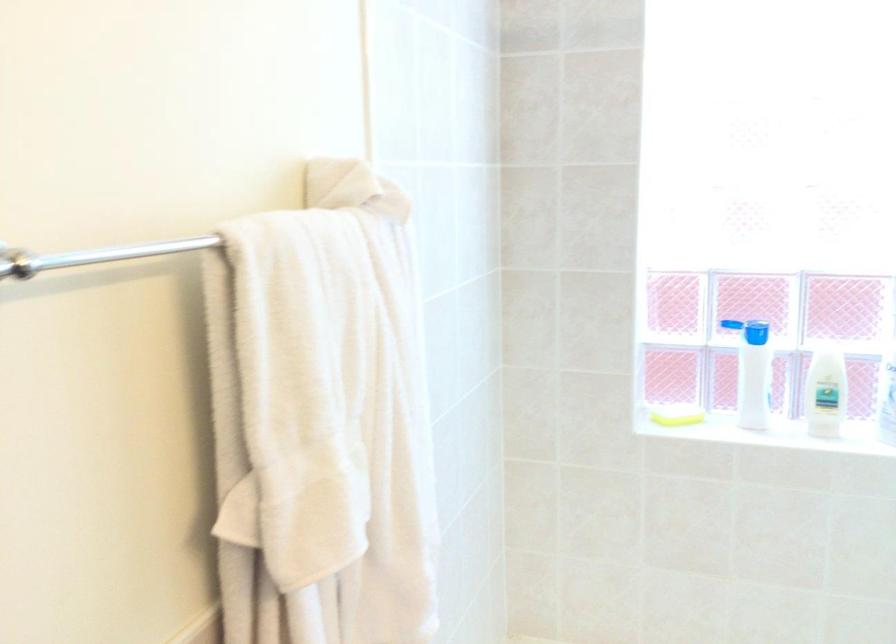
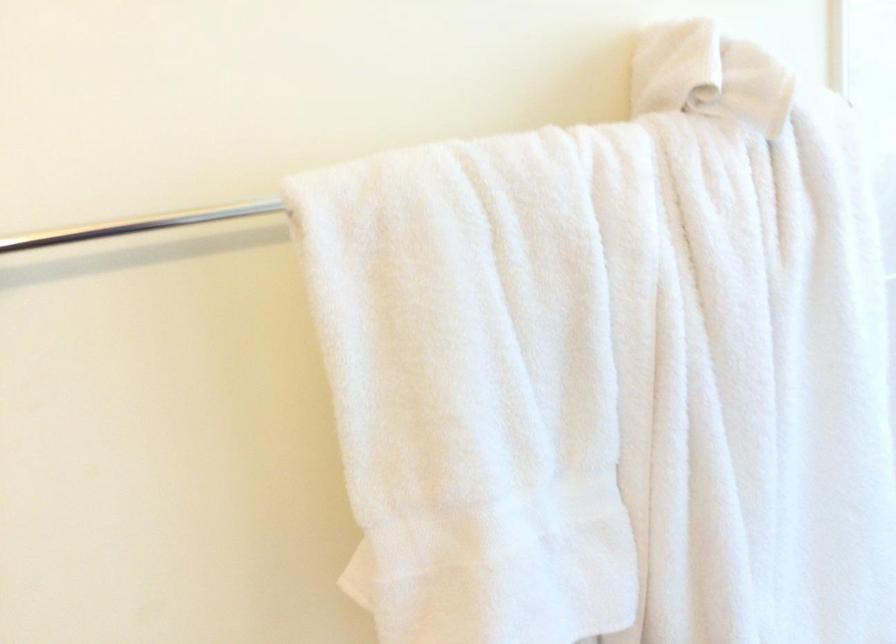
In the second image, find the point that corresponds to [346,322] in the first image.

(607, 344)